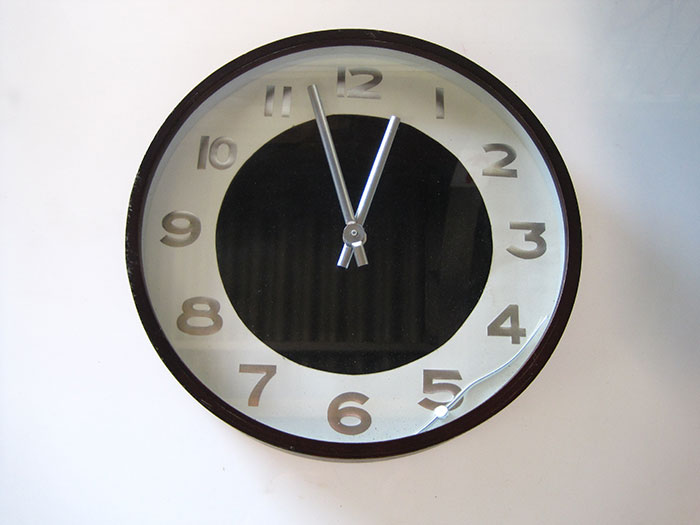
The width and height of the screenshot is (700, 525). I want to click on black circle onside clock, so click(x=316, y=253).